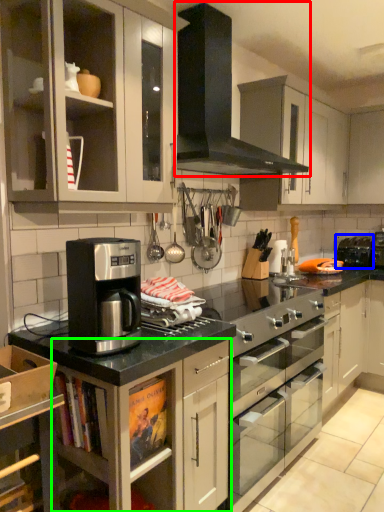
Question: Which is farther away from gas stove (highlighted by a red box)? appliance (highlighted by a blue box) or cabinetry (highlighted by a green box)?

Choices:
 (A) appliance
 (B) cabinetry

Answer: (A)